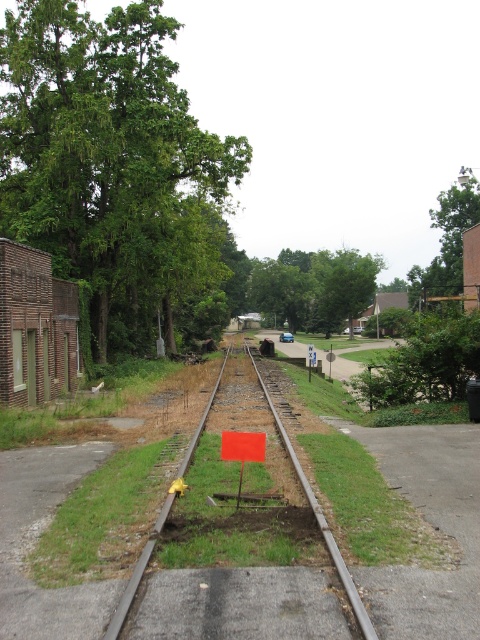
Question: Does smooth metal train track at center have a smaller size compared to blue plastic sign at center?

Choices:
 (A) no
 (B) yes

Answer: (B)

Question: Which object is farther from the camera taking this photo?

Choices:
 (A) smooth metal train track at center
 (B) blue plastic sign at center
 (C) orange plastic sign at center

Answer: (B)

Question: Is smooth metal train track at center positioned in front of orange plastic sign at center?

Choices:
 (A) yes
 (B) no

Answer: (A)

Question: Is orange plastic sign at center smaller than blue plastic sign at center?

Choices:
 (A) no
 (B) yes

Answer: (B)

Question: Which point appears closest to the camera in this image?

Choices:
 (A) tap(243, 435)
 (B) tap(313, 355)

Answer: (A)

Question: Estimate the real-world distances between objects in this image. Which object is farther from the blue plastic sign at center?

Choices:
 (A) orange plastic sign at center
 (B) smooth metal train track at center

Answer: (A)